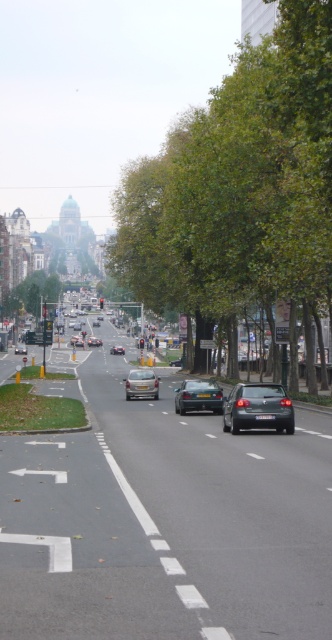
Is point (283, 410) less distant than point (153, 376)?

Yes.

Does glossy black car at lower right have a lesser width compared to metallic silver car at center?

Incorrect, glossy black car at lower right's width is not less than metallic silver car at center's.

Is point (277, 417) in front of point (157, 385)?

That is True.

This screenshot has width=332, height=640. In order to click on glossy black car at lower right in this screenshot , I will do `click(257, 408)`.

Based on the photo, can you confirm if green leafy tree at left is wider than matte silver sedan at center?

Yes, green leafy tree at left is wider than matte silver sedan at center.

Does green leafy tree at left have a greater height compared to matte silver sedan at center?

Yes.

Does point (32, 314) come behind point (98, 324)?

No, it is not.

Identify the location of green leafy tree at left. (32, 292).

Does green leafy tree at center appear on the left side of silver metallic car at center?

In fact, green leafy tree at center is to the right of silver metallic car at center.

Between green leafy tree at center and silver metallic car at center, which one appears on the right side from the viewer's perspective?

green leafy tree at center

This screenshot has width=332, height=640. What are the coordinates of `green leafy tree at center` in the screenshot? It's located at (240, 182).